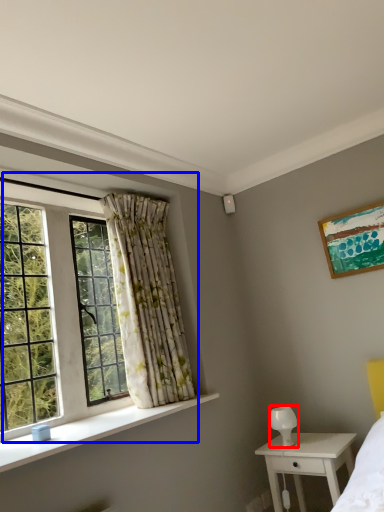
Question: Which point is further to the camera, lamp (highlighted by a red box) or window (highlighted by a blue box)?

Choices:
 (A) lamp
 (B) window

Answer: (A)